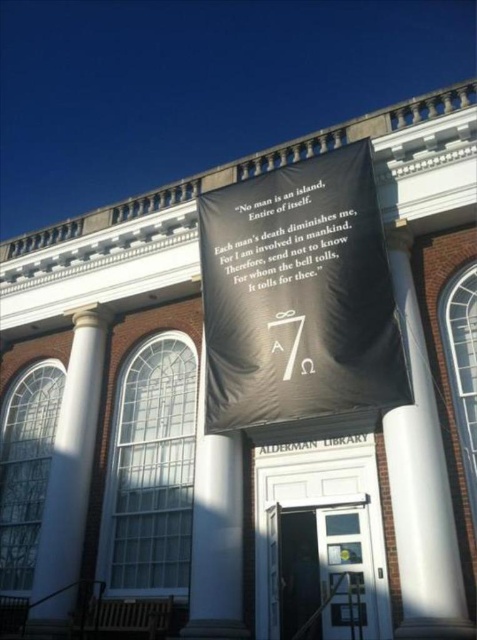
Question: Among these objects, which one is nearest to the camera?

Choices:
 (A) white marble pillar at center
 (B) black fabric banner at center
 (C) white smooth column at left
 (D) white smooth column at center

Answer: (D)

Question: Estimate the real-world distances between objects in this image. Which object is closer to the black fabric banner at center?

Choices:
 (A) white smooth column at center
 (B) black paper banner at center
 (C) white marble pillar at center

Answer: (B)

Question: Considering the relative positions of white smooth column at center and black paper banner at center in the image provided, where is white smooth column at center located with respect to black paper banner at center?

Choices:
 (A) right
 (B) left

Answer: (A)

Question: Does white smooth column at left have a larger size compared to white marble pillar at center?

Choices:
 (A) yes
 (B) no

Answer: (A)

Question: Based on their relative distances, which object is farther from the black paper banner at center?

Choices:
 (A) white marble pillar at center
 (B) black fabric banner at center
 (C) white smooth column at center

Answer: (A)

Question: Does black fabric banner at center have a greater width compared to white marble pillar at center?

Choices:
 (A) yes
 (B) no

Answer: (A)